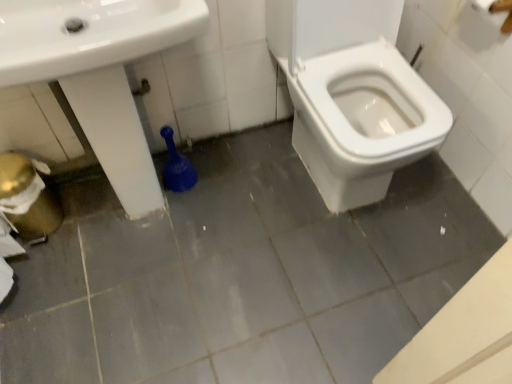
Question: Would you say white glossy toilet at center is outside white glossy sink at lower left?

Choices:
 (A) yes
 (B) no

Answer: (A)

Question: Could you tell me if white glossy toilet at center is facing white glossy sink at lower left?

Choices:
 (A) yes
 (B) no

Answer: (B)

Question: From the image's perspective, would you say white glossy toilet at center is positioned over white glossy sink at lower left?

Choices:
 (A) no
 (B) yes

Answer: (B)

Question: From the image's perspective, is white glossy toilet at center under white glossy sink at lower left?

Choices:
 (A) yes
 (B) no

Answer: (B)

Question: Considering the relative sizes of white glossy toilet at center and white glossy sink at lower left in the image provided, is white glossy toilet at center wider than white glossy sink at lower left?

Choices:
 (A) yes
 (B) no

Answer: (A)

Question: Is white glossy toilet at center to the left of white glossy sink at lower left from the viewer's perspective?

Choices:
 (A) no
 (B) yes

Answer: (A)

Question: From a real-world perspective, is white glossy sink at lower left on top of white glossy toilet at center?

Choices:
 (A) no
 (B) yes

Answer: (B)

Question: From the image's perspective, does white glossy sink at lower left appear lower than white glossy toilet at center?

Choices:
 (A) yes
 (B) no

Answer: (A)

Question: Considering the relative sizes of white glossy sink at lower left and white glossy toilet at center in the image provided, is white glossy sink at lower left wider than white glossy toilet at center?

Choices:
 (A) no
 (B) yes

Answer: (A)

Question: Considering the relative sizes of white glossy sink at lower left and white glossy toilet at center in the image provided, is white glossy sink at lower left thinner than white glossy toilet at center?

Choices:
 (A) no
 (B) yes

Answer: (B)

Question: Is white glossy sink at lower left positioned before white glossy toilet at center?

Choices:
 (A) no
 (B) yes

Answer: (B)

Question: From the image's perspective, is white glossy sink at lower left on top of white glossy toilet at center?

Choices:
 (A) no
 (B) yes

Answer: (A)

Question: Would you say white glossy sink at lower left is to the left or to the right of white glossy toilet at center in the picture?

Choices:
 (A) right
 (B) left

Answer: (B)